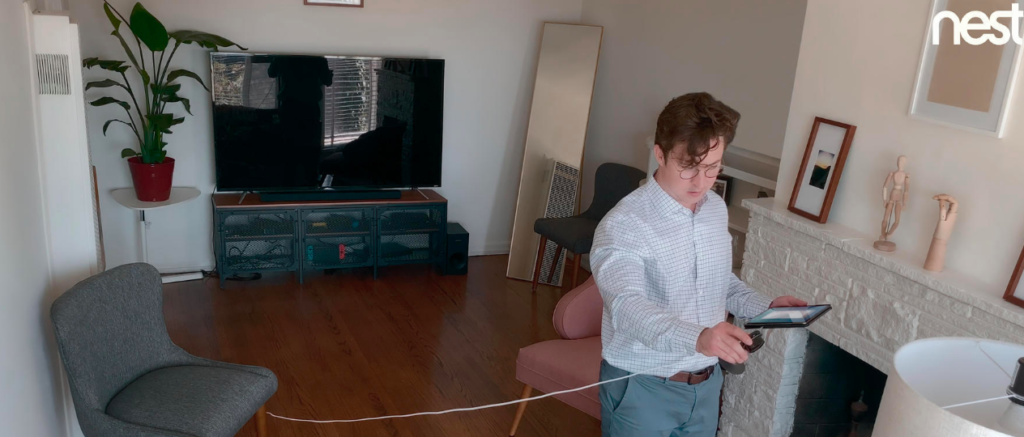
The height and width of the screenshot is (437, 1024). I want to click on tablet, so click(781, 314).